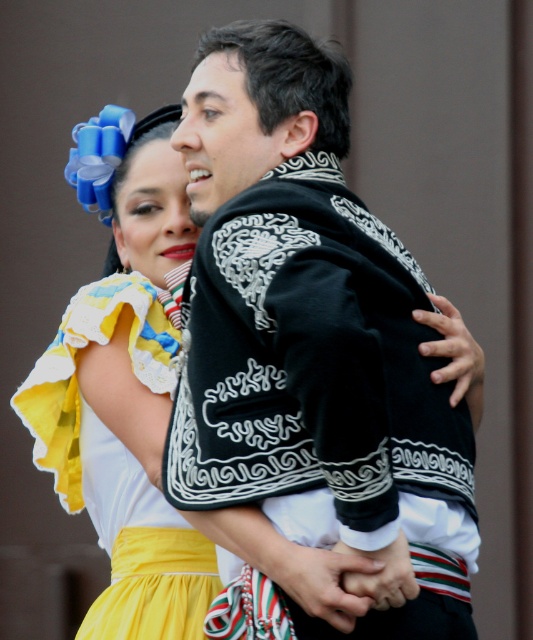
You are a photographer setting up for a cultural event. You need to position a spotlight so it illuminates both the black embroidered jacket at center and the yellow satin dress at lower left. Given their vertical positions, which object should be placed higher to ensure both are equally lit?

The black embroidered jacket at center has a greater height compared to the yellow satin dress at lower left. To ensure both are equally lit, the spotlight should be positioned higher to accommodate the taller black embroidered jacket at center, allowing the light to reach both objects effectively.

You are a photographer setting up for a cultural event. You need to position a spotlight so that it illuminates both the black embroidered jacket at center and the yellow satin dress at lower left without casting shadows on the background. Based on their positions, where should you place the spotlight?

The black embroidered jacket at center is in front of the yellow satin dress at lower left. To avoid casting shadows on the background, the spotlight should be placed behind the yellow satin dress at lower left, shining towards the front where the black embroidered jacket at center is positioned.

You are organizing a cultural festival and need to arrange two traditional outfits on a display stand. The black embroidered jacket at center and the yellow satin dress at lower left must be placed side by side. Based on their sizes, which outfit should be placed on the left side of the display to ensure proper visibility for visitors?

The black embroidered jacket at center should be placed on the left side of the display because it has a larger size compared to the yellow satin dress at lower left, ensuring it stands out and is easily visible to visitors.